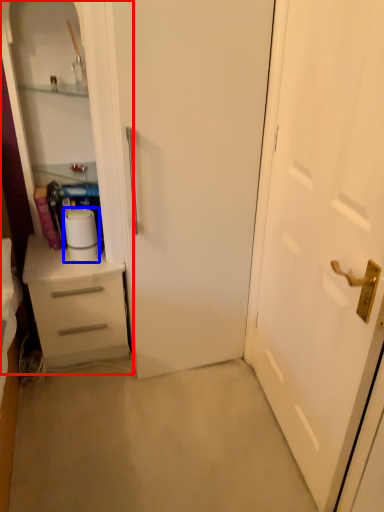
Question: Which object appears closest to the camera in this image, dresser (highlighted by a red box) or paper towel (highlighted by a blue box)?

Choices:
 (A) dresser
 (B) paper towel

Answer: (A)